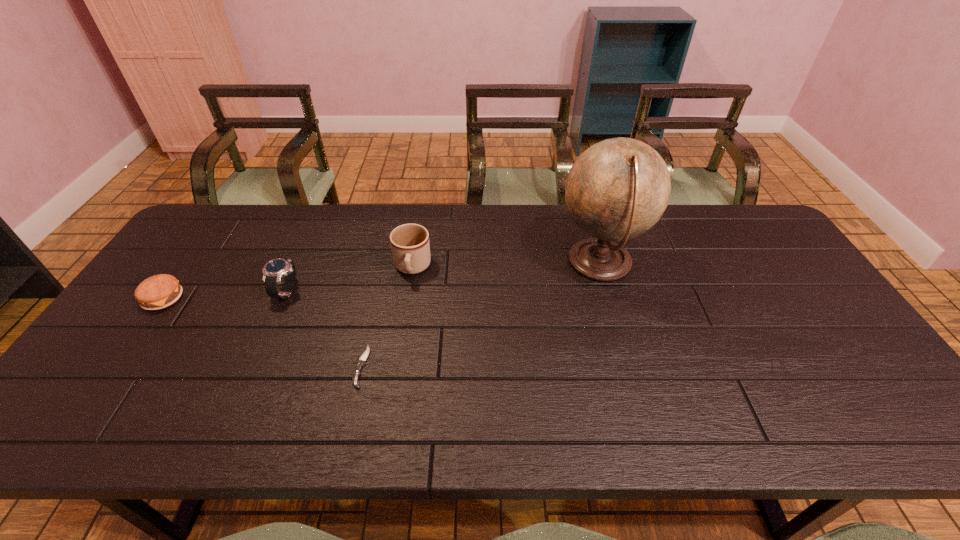
The width and height of the screenshot is (960, 540). Identify the location of free space at the right edge of the desktop. (830, 318).

In the image, there is a desktop. Find the location of `vacant region at the far left corner`. vacant region at the far left corner is located at coordinates (208, 229).

Find the location of a particular element. vacant point located between the tallest object and the second object from left to right is located at coordinates [444, 278].

The image size is (960, 540). I want to click on vacant area that lies between the nearest object and the leftmost object, so click(262, 332).

Where is `vacant space in between the third object from left to right and the rightmost object`? The height and width of the screenshot is (540, 960). vacant space in between the third object from left to right and the rightmost object is located at coordinates (481, 315).

This screenshot has height=540, width=960. Identify the location of unoccupied position between the second shortest object and the nearest object. (262, 332).

Where is `vacant space that's between the pocketknife and the tallest object`? Image resolution: width=960 pixels, height=540 pixels. vacant space that's between the pocketknife and the tallest object is located at coordinates (481, 315).

This screenshot has height=540, width=960. I want to click on free space between the hamburger and the watch, so click(226, 295).

The height and width of the screenshot is (540, 960). In order to click on empty location between the globe and the third object from left to right in this screenshot , I will do `click(481, 315)`.

Where is `unoccupied position between the globe and the mug`? The height and width of the screenshot is (540, 960). unoccupied position between the globe and the mug is located at coordinates (506, 266).